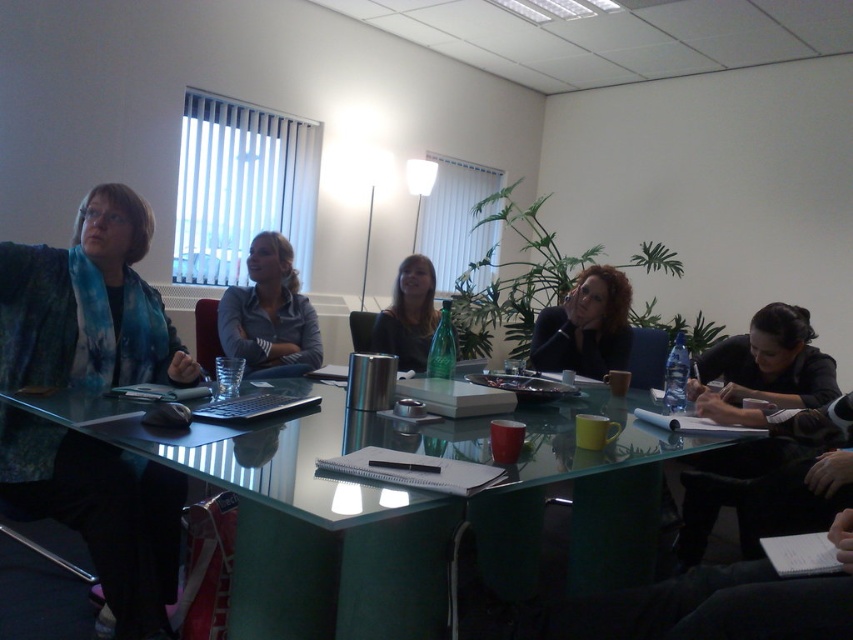
You are a photographer setting up for a group photo in the conference room. You need to ensure that the black glossy hair at lower right and the matte blue shirt at center are both visible in the frame. Given their sizes, which object should you focus on to ensure both are in the frame without cropping?

The black glossy hair at lower right is wider than the matte blue shirt at center, so focusing on the black glossy hair at lower right would ensure both are visible in the frame since it requires more space.

You are attending a meeting and need to pass a document to the person with dark brown hair at center. You are currently sitting at the black glossy hair at lower right. Which direction should you move to reach them?

The black glossy hair at lower right is located below dark brown hair at center, so you should move upwards to reach the person with dark brown hair at center.